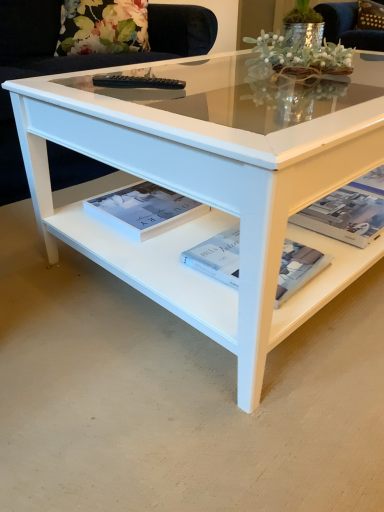
Looking at this image, what is the approximate width of white paper magazine at center, which appears as the 2th magazine when viewed from the left?

10.46 inches.

What is the approximate width of brown fabric pillow at upper right?

It is 7.77 inches.

The width and height of the screenshot is (384, 512). What are the coordinates of `brown fabric pillow at upper right` in the screenshot? It's located at (370, 15).

At what (x,y) coordinates should I click in order to perform the action: click on white glossy coffee table at center. Please return your answer as a coordinate pair (x, y). This screenshot has width=384, height=512. Looking at the image, I should click on 206,186.

Find the location of a particular element. The image size is (384, 512). magazine located on the right of white paper magazine at center, which appears as the 2th magazine when viewed from the left is located at coordinates (349, 211).

Is white paper magazine at center, acting as the second magazine starting from the right, positioned beyond the bounds of white glossy magazine at lower right, which ranks as the 3th magazine in left-to-right order?

Indeed, white paper magazine at center, acting as the second magazine starting from the right, is completely outside white glossy magazine at lower right, which ranks as the 3th magazine in left-to-right order.

Considering the points (293, 243) and (351, 213), which point is behind, point (293, 243) or point (351, 213)?

Positioned behind is point (351, 213).

Is point (169, 223) positioned behind point (367, 176)?

No, it is in front of (367, 176).

There is a white glossy book at center, the first magazine viewed from the left. Where is `the 1st magazine below it (from a real-world perspective)`? Image resolution: width=384 pixels, height=512 pixels. the 1st magazine below it (from a real-world perspective) is located at coordinates (349, 211).

Considering the sizes of objects white glossy book at center, the first magazine viewed from the left, and white glossy magazine at lower right, which ranks as the 3th magazine in left-to-right order, in the image provided, who is bigger, white glossy book at center, the first magazine viewed from the left, or white glossy magazine at lower right, which ranks as the 3th magazine in left-to-right order,?

With larger size is white glossy book at center, the first magazine viewed from the left.

Could you measure the distance between white glossy book at center, placed as the third magazine when sorted from right to left, and white glossy magazine at lower right, the 1th magazine from the right?

white glossy book at center, placed as the third magazine when sorted from right to left, and white glossy magazine at lower right, the 1th magazine from the right, are 40.07 centimeters apart.

From the image's perspective, which is above, white glossy magazine at lower right, which ranks as the 3th magazine in left-to-right order, or white glossy coffee table at center?

white glossy coffee table at center appears higher in the image.

Looking at this image, considering the positions of objects white glossy magazine at lower right, which ranks as the 3th magazine in left-to-right order, and white glossy coffee table at center in the image provided, who is more to the right, white glossy magazine at lower right, which ranks as the 3th magazine in left-to-right order, or white glossy coffee table at center?

white glossy magazine at lower right, which ranks as the 3th magazine in left-to-right order, is more to the right.

Is point (313, 218) more distant than point (71, 94)?

Yes.

Considering the positions of objects brown fabric pillow at upper right and white glossy book at center, the first magazine viewed from the left, in the image provided, who is more to the right, brown fabric pillow at upper right or white glossy book at center, the first magazine viewed from the left,?

brown fabric pillow at upper right.

From the picture: Would you say brown fabric pillow at upper right is outside white glossy book at center, the first magazine viewed from the left?

Yes, brown fabric pillow at upper right is outside of white glossy book at center, the first magazine viewed from the left.

From the picture: In terms of height, does brown fabric pillow at upper right look taller or shorter compared to white glossy book at center, the first magazine viewed from the left?

Clearly, brown fabric pillow at upper right is taller compared to white glossy book at center, the first magazine viewed from the left.

Consider the image. Between brown fabric pillow at upper right and white glossy book at center, placed as the third magazine when sorted from right to left, which one is positioned behind?

brown fabric pillow at upper right is more distant.

Which is correct: white paper magazine at center, which appears as the 2th magazine when viewed from the left, is inside white glossy coffee table at center, or outside of it?

white paper magazine at center, which appears as the 2th magazine when viewed from the left, exists outside the volume of white glossy coffee table at center.

Does point (300, 258) lie in front of point (49, 233)?

That is True.

What's the angular difference between white paper magazine at center, acting as the second magazine starting from the right, and white glossy coffee table at center's facing directions?

They differ by 2.73 degrees in their facing directions.

From the image's perspective, is white paper magazine at center, acting as the second magazine starting from the right, located beneath white glossy coffee table at center?

Yes, from the image's perspective, white paper magazine at center, acting as the second magazine starting from the right, is below white glossy coffee table at center.

Can you confirm if brown fabric pillow at upper right is shorter than white glossy magazine at lower right, which ranks as the 3th magazine in left-to-right order?

No.

Considering the sizes of brown fabric pillow at upper right and white glossy magazine at lower right, the 1th magazine from the right, in the image, is brown fabric pillow at upper right bigger or smaller than white glossy magazine at lower right, the 1th magazine from the right,?

brown fabric pillow at upper right is bigger than white glossy magazine at lower right, the 1th magazine from the right.

Is brown fabric pillow at upper right far away from white glossy magazine at lower right, the 1th magazine from the right?

brown fabric pillow at upper right is far away from white glossy magazine at lower right, the 1th magazine from the right.

Is brown fabric pillow at upper right facing towards white glossy magazine at lower right, which ranks as the 3th magazine in left-to-right order?

Yes, brown fabric pillow at upper right is facing white glossy magazine at lower right, which ranks as the 3th magazine in left-to-right order.

Between point (334, 195) and point (163, 205), which one is positioned behind?

Point (334, 195)

From a real-world perspective, which object rests below the other?

white glossy magazine at lower right, which ranks as the 3th magazine in left-to-right order, is physically lower.

Based on the photo, is white glossy magazine at lower right, the 1th magazine from the right, looking in the opposite direction of white glossy book at center, placed as the third magazine when sorted from right to left?

No, white glossy magazine at lower right, the 1th magazine from the right, is not facing the opposite direction of white glossy book at center, placed as the third magazine when sorted from right to left.

In the scene shown: Considering the relative sizes of white glossy magazine at lower right, which ranks as the 3th magazine in left-to-right order, and white glossy book at center, the first magazine viewed from the left, in the image provided, is white glossy magazine at lower right, which ranks as the 3th magazine in left-to-right order, taller than white glossy book at center, the first magazine viewed from the left,?

Incorrect, the height of white glossy magazine at lower right, which ranks as the 3th magazine in left-to-right order, is not larger of that of white glossy book at center, the first magazine viewed from the left.

Where is `the 1st magazine above the white paper magazine at center, acting as the second magazine starting from the right (from a real-world perspective)`? The height and width of the screenshot is (512, 384). the 1st magazine above the white paper magazine at center, acting as the second magazine starting from the right (from a real-world perspective) is located at coordinates 349,211.

Locate an element on the screen. This screenshot has height=512, width=384. magazine behind the white glossy magazine at lower right, which ranks as the 3th magazine in left-to-right order is located at coordinates (144, 210).

Estimate the real-world distances between objects in this image. Which object is closer to white glossy magazine at lower right, the 1th magazine from the right, white glossy coffee table at center or white glossy book at center, the first magazine viewed from the left?

white glossy coffee table at center lies closer to white glossy magazine at lower right, the 1th magazine from the right, than the other object.

Estimate the real-world distances between objects in this image. Which object is closer to white paper magazine at center, acting as the second magazine starting from the right, white glossy book at center, the first magazine viewed from the left, or brown fabric pillow at upper right?

white glossy book at center, the first magazine viewed from the left, is positioned closer to the anchor white paper magazine at center, acting as the second magazine starting from the right.

Considering their positions, is white glossy magazine at lower right, which ranks as the 3th magazine in left-to-right order, positioned further to white glossy coffee table at center than brown fabric pillow at upper right?

Among the two, brown fabric pillow at upper right is located further to white glossy coffee table at center.

Looking at the image, which one is located closer to white glossy book at center, placed as the third magazine when sorted from right to left, brown fabric pillow at upper right or white paper magazine at center, acting as the second magazine starting from the right?

Among the two, white paper magazine at center, acting as the second magazine starting from the right, is located nearer to white glossy book at center, placed as the third magazine when sorted from right to left.

From the image, which object appears to be farther from white glossy magazine at lower right, the 1th magazine from the right, white glossy book at center, placed as the third magazine when sorted from right to left, or brown fabric pillow at upper right?

brown fabric pillow at upper right.

Based on their spatial positions, is brown fabric pillow at upper right or white glossy coffee table at center closer to white glossy magazine at lower right, which ranks as the 3th magazine in left-to-right order?

white glossy coffee table at center.

Estimate the real-world distances between objects in this image. Which object is further from white glossy coffee table at center, white glossy book at center, the first magazine viewed from the left, or white paper magazine at center, acting as the second magazine starting from the right?

white paper magazine at center, acting as the second magazine starting from the right, is positioned further to the anchor white glossy coffee table at center.

Based on their spatial positions, is white glossy magazine at lower right, which ranks as the 3th magazine in left-to-right order, or white glossy coffee table at center closer to white glossy book at center, the first magazine viewed from the left?

Among the two, white glossy coffee table at center is located nearer to white glossy book at center, the first magazine viewed from the left.

Find the location of a particular element. The width and height of the screenshot is (384, 512). magazine located between white glossy magazine at lower right, which ranks as the 3th magazine in left-to-right order, and brown fabric pillow at upper right in the depth direction is located at coordinates (144, 210).

Find the location of a particular element. magazine between white glossy book at center, the first magazine viewed from the left, and white glossy magazine at lower right, which ranks as the 3th magazine in left-to-right order, in the horizontal direction is located at coordinates (217, 257).